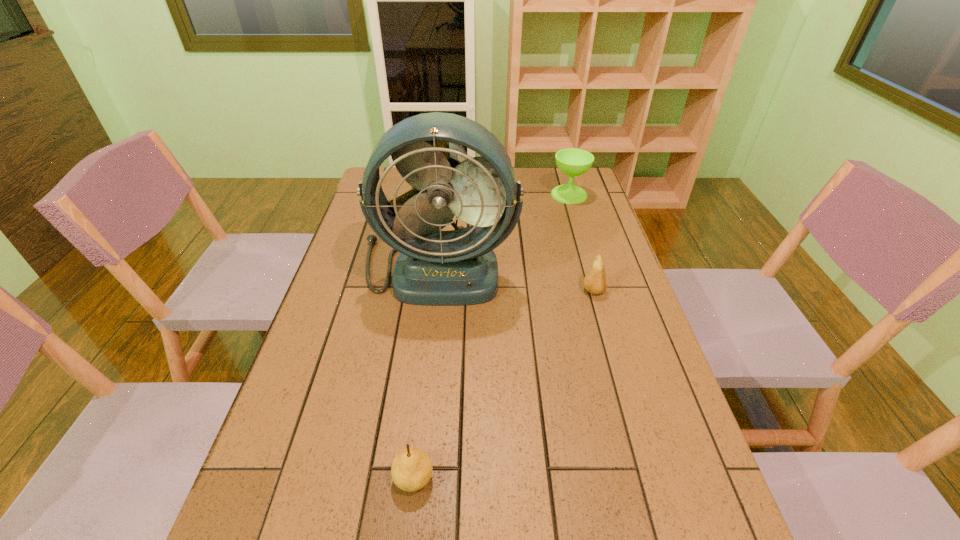
Identify the location of object at the far edge. (573, 162).

The height and width of the screenshot is (540, 960). Find the location of `object positioned at the left edge`. object positioned at the left edge is located at coordinates (458, 267).

Find the location of a particular element. This screenshot has width=960, height=540. wineglass that is at the right edge is located at coordinates (573, 162).

You are a GUI agent. You are given a task and a screenshot of the screen. Output one action in this format:
    pyautogui.click(x=<x>, y=<y>)
    Task: Click on the pear that is positioned at the right edge
    The image size is (960, 540).
    Given the screenshot: What is the action you would take?
    pyautogui.click(x=595, y=281)

The width and height of the screenshot is (960, 540). Find the location of `object that is at the far right corner`. object that is at the far right corner is located at coordinates (573, 162).

Identify the location of free space at the left edge of the desktop. (304, 379).

Identify the location of vacant area at the right edge. The image size is (960, 540). (557, 205).

This screenshot has width=960, height=540. What are the coordinates of `free spot between the fan and the left pear` in the screenshot? It's located at (426, 372).

The image size is (960, 540). In order to click on free point between the right pear and the fan in this screenshot , I will do `click(516, 279)`.

Where is `free space between the right pear and the left pear`? This screenshot has height=540, width=960. free space between the right pear and the left pear is located at coordinates (504, 384).